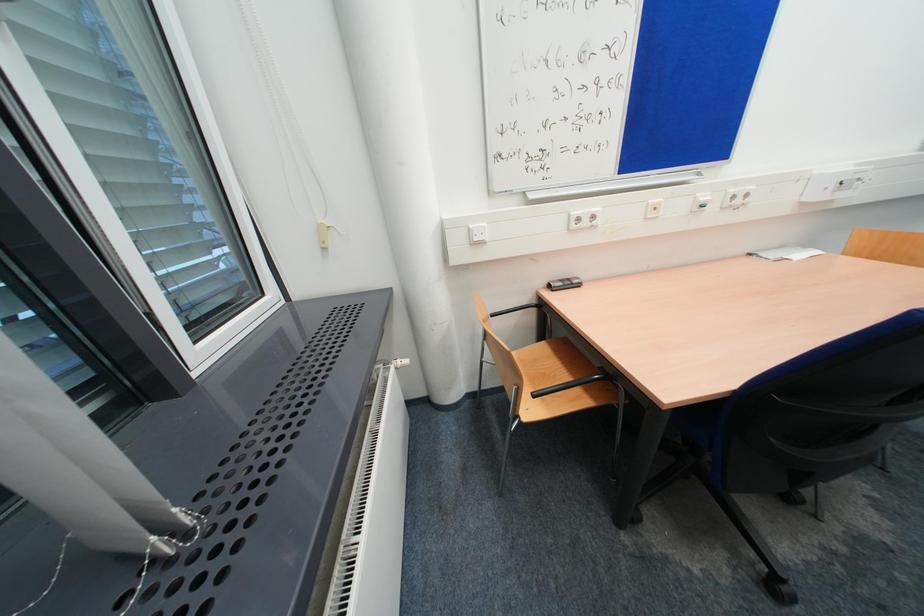
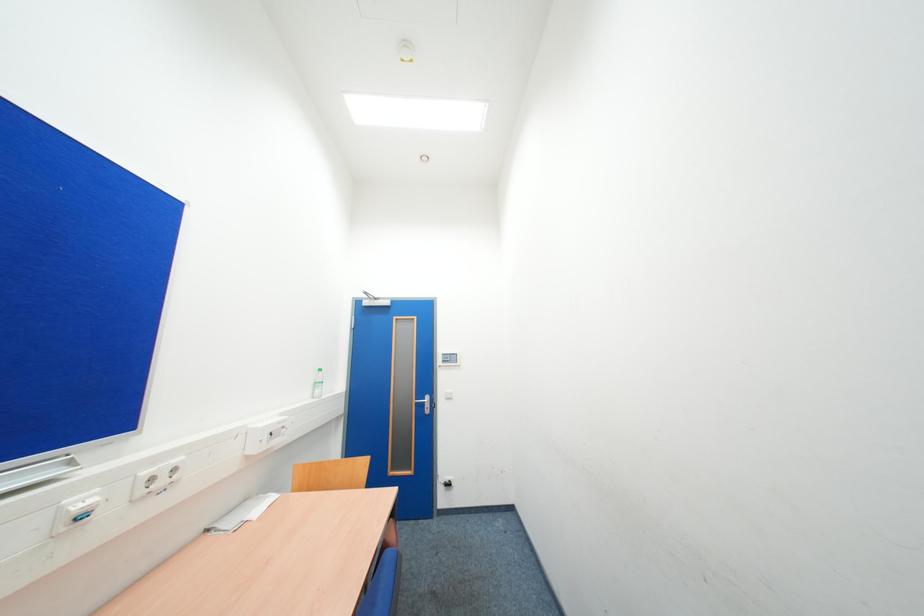
Based on the continuous images, in which direction is the camera rotating?

The rotation direction of the camera is right-up.